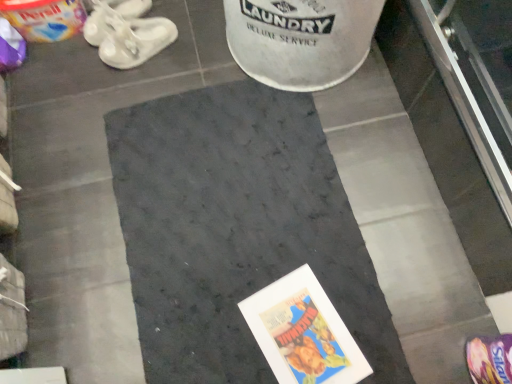
Question: Does purple fabric footwear at lower right, which ranks as the third footwear in back-to-front order, lie behind white rubber sandals at upper left, the 2th footwear when ordered from bottom to top?

Choices:
 (A) yes
 (B) no

Answer: (B)

Question: Can you confirm if purple fabric footwear at lower right, the 3th footwear from the left, is smaller than white rubber sandals at upper left, the second footwear in the back-to-front sequence?

Choices:
 (A) yes
 (B) no

Answer: (A)

Question: From the image's perspective, is purple fabric footwear at lower right, the 3th footwear from the left, over white rubber sandals at upper left, the 2th footwear when ordered from bottom to top?

Choices:
 (A) yes
 (B) no

Answer: (B)

Question: Does purple fabric footwear at lower right, arranged as the 3th footwear when viewed from the top, come in front of white rubber sandals at upper left, the second footwear in the back-to-front sequence?

Choices:
 (A) no
 (B) yes

Answer: (B)

Question: Is purple fabric footwear at lower right, the 3th footwear from the left, thinner than white rubber sandals at upper left, which is the second footwear from right to left?

Choices:
 (A) no
 (B) yes

Answer: (B)

Question: Can you confirm if purple fabric footwear at lower right, the 3th footwear from the left, is taller than white rubber sandals at upper left, the 2th footwear when ordered from bottom to top?

Choices:
 (A) no
 (B) yes

Answer: (B)

Question: Is white rubber sandals at upper left, the 2th footwear positioned from the top, to the right of white rubber shoes at upper left, the 3th footwear when ordered from front to back, from the viewer's perspective?

Choices:
 (A) yes
 (B) no

Answer: (A)

Question: Is white rubber sandals at upper left, which is counted as the 2th footwear, starting from the left, shorter than white rubber shoes at upper left, the 3th footwear when ordered from front to back?

Choices:
 (A) no
 (B) yes

Answer: (A)

Question: Is white rubber sandals at upper left, the 2th footwear when ordered from bottom to top, not near white rubber shoes at upper left, which is the 3th footwear in bottom-to-top order?

Choices:
 (A) yes
 (B) no

Answer: (B)

Question: From a real-world perspective, is white rubber sandals at upper left, the second footwear in the back-to-front sequence, located higher than white rubber shoes at upper left, which is the first footwear in left-to-right order?

Choices:
 (A) no
 (B) yes

Answer: (B)

Question: Is white rubber sandals at upper left, which is the second footwear from right to left, turned away from white rubber shoes at upper left, the first footwear positioned from the top?

Choices:
 (A) yes
 (B) no

Answer: (B)

Question: Is white rubber sandals at upper left, the 2th footwear when ordered from bottom to top, in contact with white rubber shoes at upper left, which is the first footwear in left-to-right order?

Choices:
 (A) yes
 (B) no

Answer: (A)

Question: Is dark gray carpet at center positioned behind white rubber shoes at upper left, the 3th footwear when ordered from front to back?

Choices:
 (A) yes
 (B) no

Answer: (B)